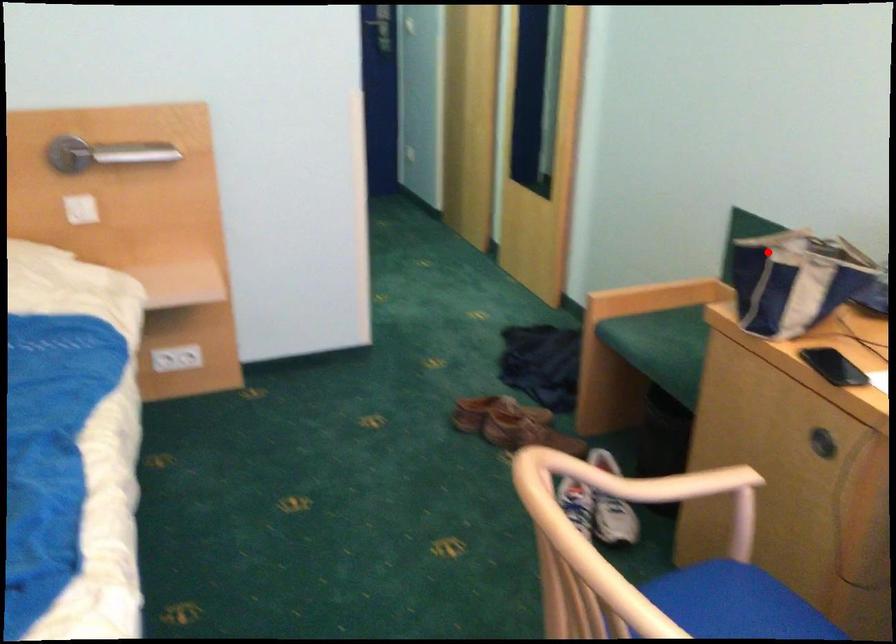
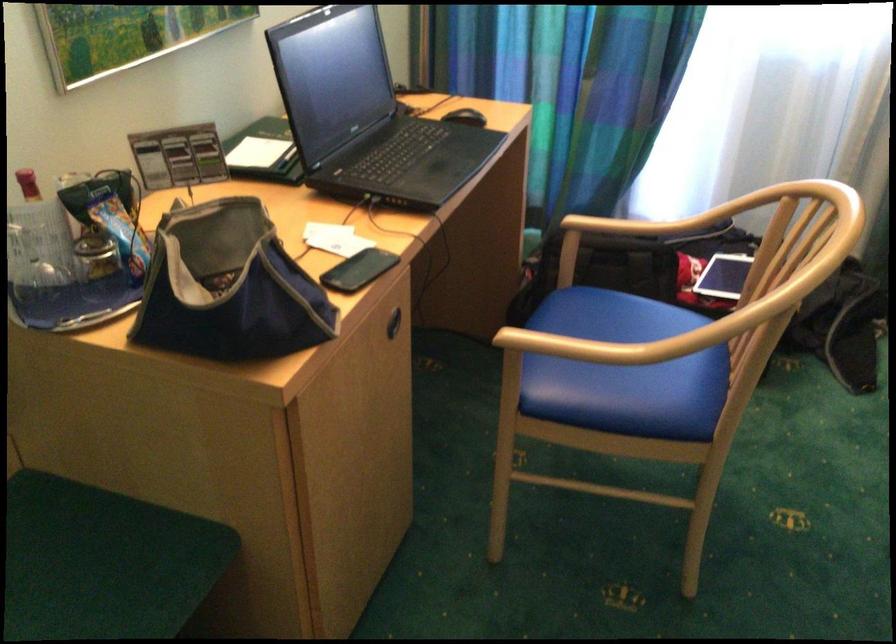
Question: I am providing you with two images of the same scene from different viewpoints. A red point is shown in image1. For the corresponding object point in image2, is it positioned nearer or farther from the camera?

Choices:
 (A) Nearer
 (B) Farther

Answer: (A)